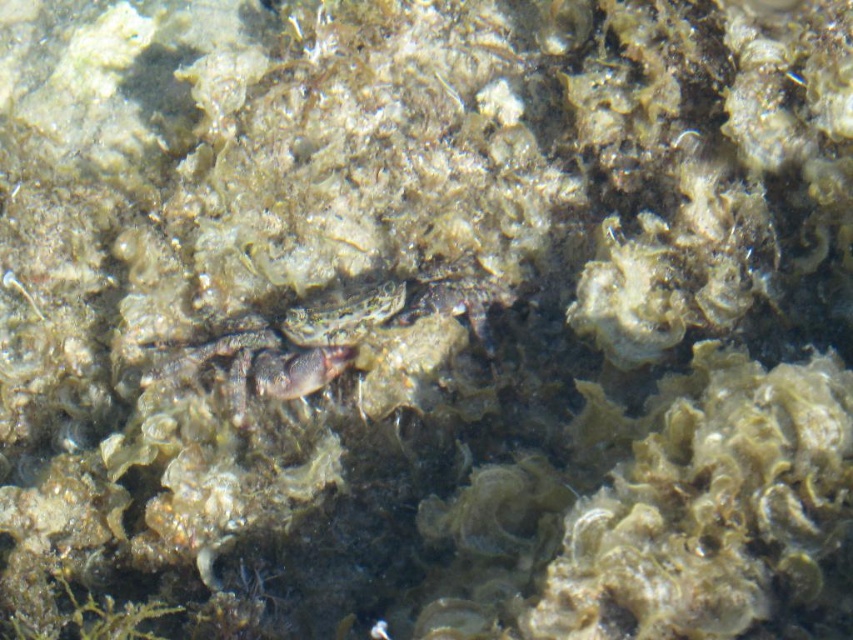
Between translucent gray crab at center and translucent greenish fish at center, which one appears on the right side from the viewer's perspective?

translucent greenish fish at center is more to the right.

Image resolution: width=853 pixels, height=640 pixels. Find the location of `translucent gray crab at center`. translucent gray crab at center is located at coordinates (292, 346).

Who is more forward, (256, 380) or (296, 324)?

Point (256, 380) is more forward.

The image size is (853, 640). In order to click on translucent gray crab at center in this screenshot , I will do `click(292, 346)`.